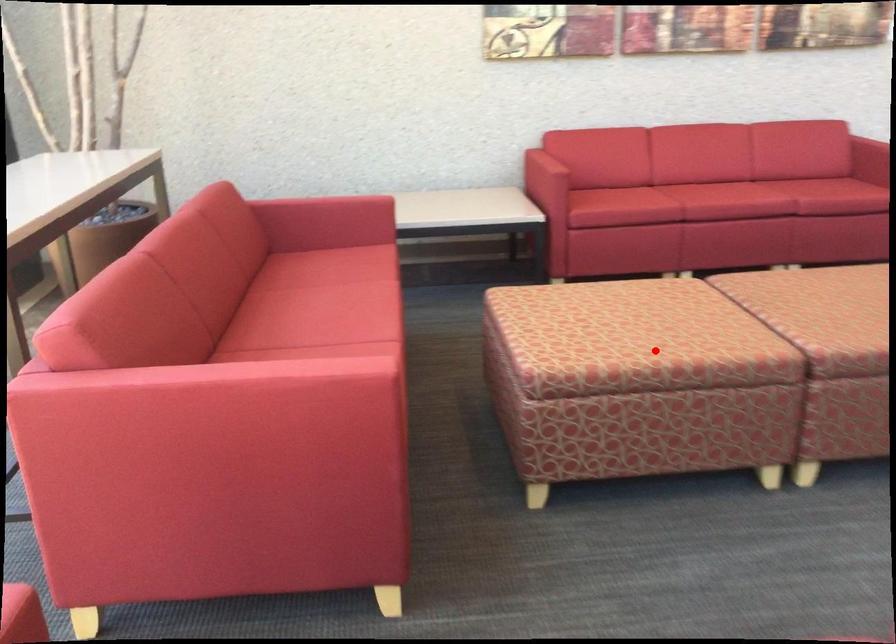
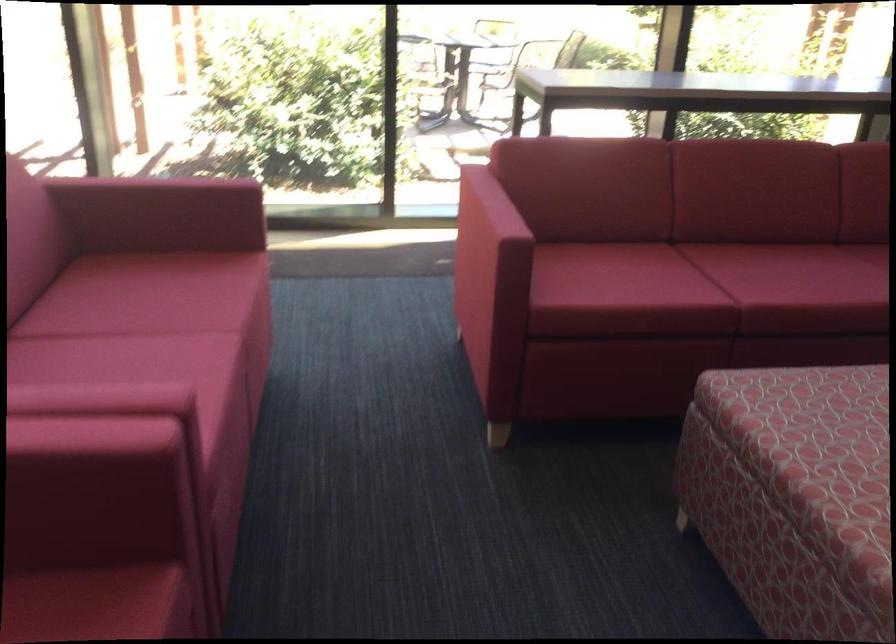
Question: I am providing you with two images of the same scene from different viewpoints. Given a red point in image1, look at the same physical point in image2. Is it:

Choices:
 (A) Closer to the viewpoint
 (B) Farther from the viewpoint

Answer: (A)